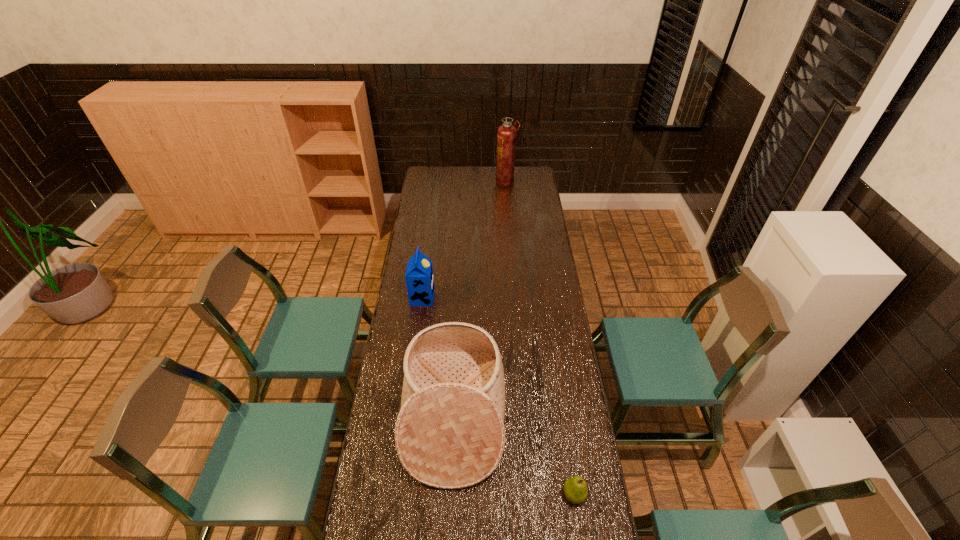
The width and height of the screenshot is (960, 540). In order to click on vacant space located with the cap open on the carton in this screenshot , I will do `click(507, 298)`.

Where is `vacant space located on the left of the rightmost object`? Image resolution: width=960 pixels, height=540 pixels. vacant space located on the left of the rightmost object is located at coordinates (538, 495).

Identify the location of object that is positioned at the far edge. (506, 133).

At what (x,y) coordinates should I click in order to perform the action: click on basket that is at the left edge. Please return your answer as a coordinate pair (x, y). This screenshot has width=960, height=540. Looking at the image, I should click on (450, 433).

Where is `carton positioned at the left edge`? carton positioned at the left edge is located at coordinates (419, 278).

Locate an element on the screen. fire extinguisher situated at the right edge is located at coordinates (506, 133).

This screenshot has height=540, width=960. I want to click on pear present at the right edge, so click(575, 489).

Where is `object that is positioned at the far right corner`? object that is positioned at the far right corner is located at coordinates (506, 133).

In the image, there is a desktop. Identify the location of vacant area at the far edge. This screenshot has width=960, height=540. (460, 179).

In the image, there is a desktop. At what (x,y) coordinates should I click in order to perform the action: click on vacant area at the left edge. Please return your answer as a coordinate pair (x, y). Looking at the image, I should click on (440, 191).